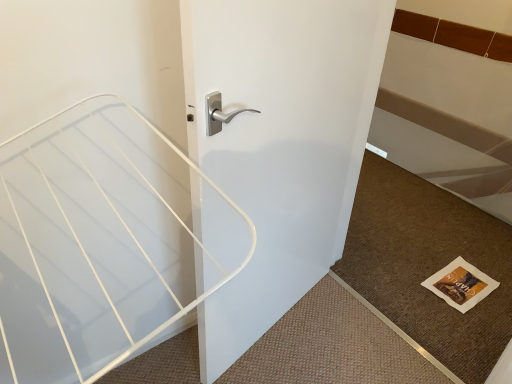
Question: Considering the relative sizes of brown textured mat at lower right and white glossy door handle at center in the image provided, is brown textured mat at lower right shorter than white glossy door handle at center?

Choices:
 (A) no
 (B) yes

Answer: (B)

Question: Does brown textured mat at lower right come behind white glossy door handle at center?

Choices:
 (A) yes
 (B) no

Answer: (A)

Question: Is white glossy door handle at center at the back of brown textured mat at lower right?

Choices:
 (A) no
 (B) yes

Answer: (A)

Question: Is brown textured mat at lower right closer to the viewer compared to white glossy door handle at center?

Choices:
 (A) yes
 (B) no

Answer: (B)

Question: Would you say brown textured mat at lower right is a long distance from white glossy door handle at center?

Choices:
 (A) yes
 (B) no

Answer: (B)

Question: Can you confirm if brown textured mat at lower right is thinner than white glossy door handle at center?

Choices:
 (A) yes
 (B) no

Answer: (B)

Question: Does white glossy door handle at center appear on the right side of brown textured mat at lower right?

Choices:
 (A) yes
 (B) no

Answer: (B)

Question: Is white glossy door handle at center positioned behind brown textured mat at lower right?

Choices:
 (A) no
 (B) yes

Answer: (A)

Question: Considering the relative sizes of white glossy door handle at center and brown textured mat at lower right in the image provided, is white glossy door handle at center wider than brown textured mat at lower right?

Choices:
 (A) no
 (B) yes

Answer: (A)

Question: Are white glossy door handle at center and brown textured mat at lower right far apart?

Choices:
 (A) no
 (B) yes

Answer: (A)

Question: Can you confirm if white glossy door handle at center is bigger than brown textured mat at lower right?

Choices:
 (A) no
 (B) yes

Answer: (B)

Question: Is the position of white glossy door handle at center less distant than that of brown textured mat at lower right?

Choices:
 (A) no
 (B) yes

Answer: (B)

Question: In terms of size, does white glossy door handle at center appear bigger or smaller than brown textured mat at lower right?

Choices:
 (A) small
 (B) big

Answer: (B)